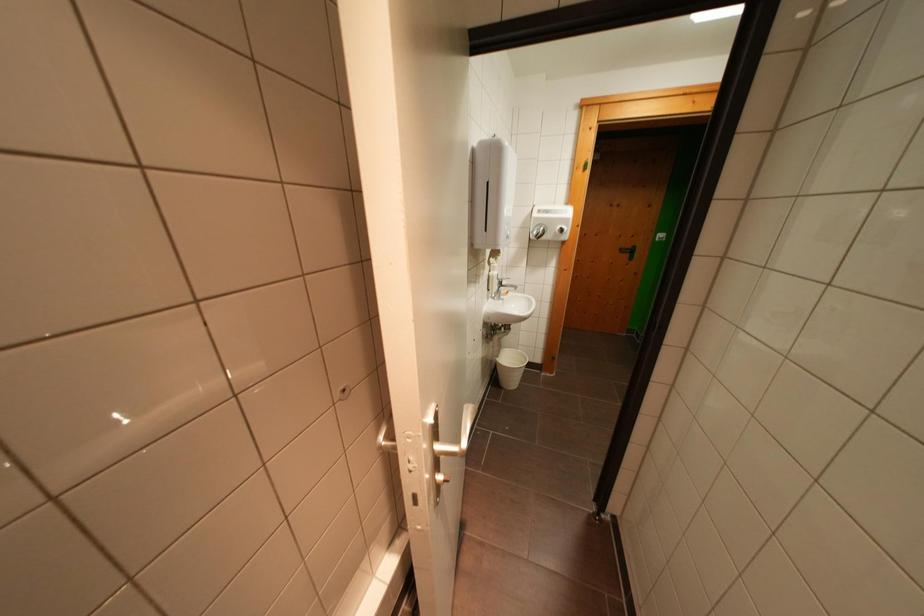
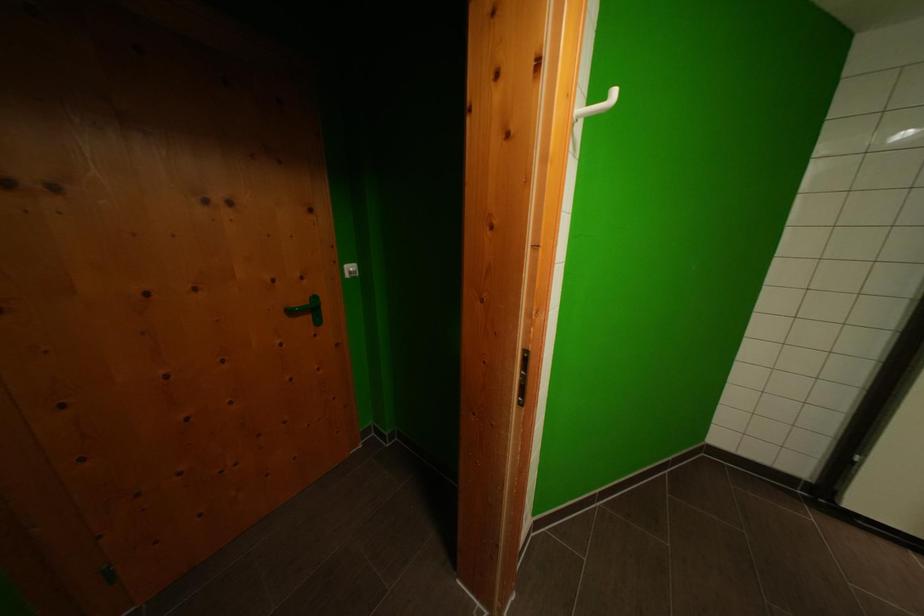
In the second image, find the point that corresponds to point 667,238 in the first image.

(358, 272)